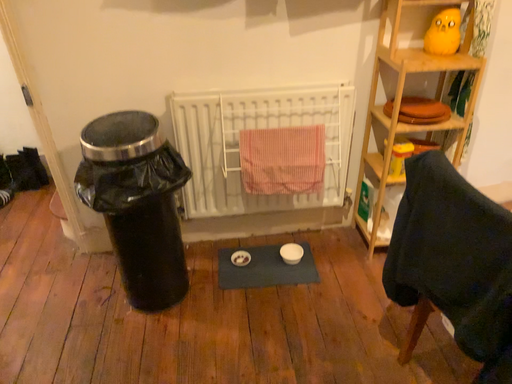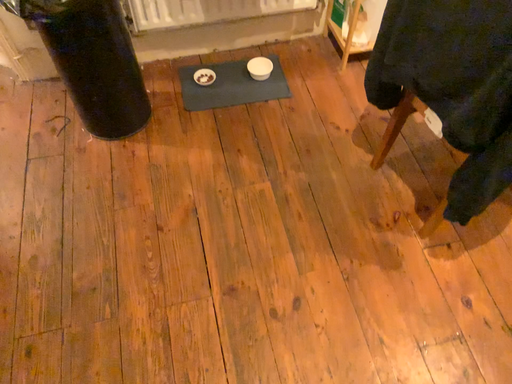
Question: Which way did the camera rotate in the video?

Choices:
 (A) rotated upward
 (B) rotated downward

Answer: (B)